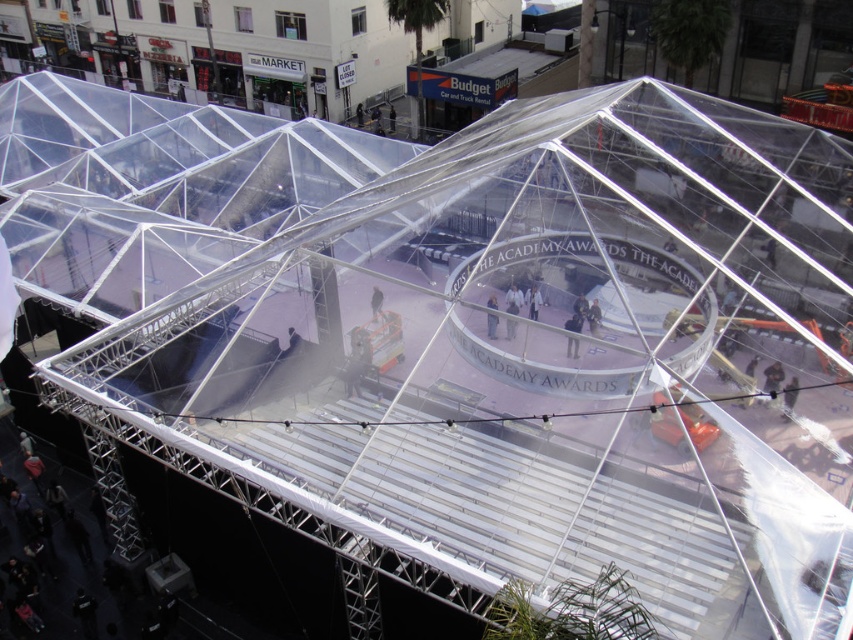
Which is in front, point (517, 289) or point (491, 337)?

Point (491, 337) is in front.

Who is more distant from viewer, (515, 326) or (490, 321)?

The point (490, 321) is behind.

Where is `light brown fabric pants at center`? The width and height of the screenshot is (853, 640). light brown fabric pants at center is located at coordinates (514, 300).

Identify the location of light brown fabric pants at center. The height and width of the screenshot is (640, 853). (514, 300).

At what (x,y) coordinates should I click in order to perform the action: click on light brown fabric pants at center. Please return your answer as a coordinate pair (x, y). Looking at the image, I should click on (514, 300).

Can you confirm if dark gray fabric jacket at center is positioned to the left of light blue denim jacket at center?

Incorrect, dark gray fabric jacket at center is not on the left side of light blue denim jacket at center.

What do you see at coordinates (573, 321) in the screenshot? The width and height of the screenshot is (853, 640). I see `dark gray fabric jacket at center` at bounding box center [573, 321].

Between point (579, 312) and point (491, 332), which one is positioned in front?

Positioned in front is point (491, 332).

This screenshot has width=853, height=640. Find the location of `dark gray fabric jacket at center`. dark gray fabric jacket at center is located at coordinates (573, 321).